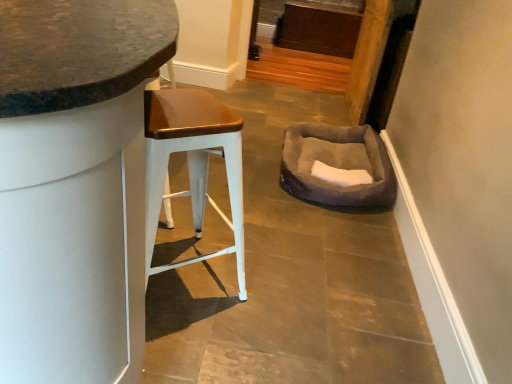
Question: Considering the relative sizes of white metal stool at left and matte white stool at left in the image provided, is white metal stool at left bigger than matte white stool at left?

Choices:
 (A) no
 (B) yes

Answer: (A)

Question: Is the depth of white metal stool at left less than that of matte white stool at left?

Choices:
 (A) yes
 (B) no

Answer: (B)

Question: Would you say white metal stool at left contains matte white stool at left?

Choices:
 (A) yes
 (B) no

Answer: (B)

Question: Does white metal stool at left have a smaller size compared to matte white stool at left?

Choices:
 (A) no
 (B) yes

Answer: (B)

Question: From the image's perspective, is white metal stool at left located above matte white stool at left?

Choices:
 (A) yes
 (B) no

Answer: (B)

Question: From a real-world perspective, relative to matte white stool at left, is white metal stool at left vertically above or below?

Choices:
 (A) above
 (B) below

Answer: (B)

Question: In the image, is white metal stool at left positioned in front of or behind matte white stool at left?

Choices:
 (A) front
 (B) behind

Answer: (B)

Question: From their relative heights in the image, would you say white metal stool at left is taller or shorter than matte white stool at left?

Choices:
 (A) tall
 (B) short

Answer: (B)

Question: From the image's perspective, is white metal stool at left positioned above or below matte white stool at left?

Choices:
 (A) above
 (B) below

Answer: (B)

Question: Considering the positions of suede-like gray bean bag at center-right and white metal stool at left in the image, is suede-like gray bean bag at center-right taller or shorter than white metal stool at left?

Choices:
 (A) short
 (B) tall

Answer: (A)

Question: Is suede-like gray bean bag at center-right spatially inside white metal stool at left, or outside of it?

Choices:
 (A) inside
 (B) outside

Answer: (B)

Question: Looking at their shapes, would you say suede-like gray bean bag at center-right is wider or thinner than white metal stool at left?

Choices:
 (A) thin
 (B) wide

Answer: (B)

Question: From a real-world perspective, is suede-like gray bean bag at center-right above or below white metal stool at left?

Choices:
 (A) below
 (B) above

Answer: (A)

Question: Considering the relative positions of matte white stool at left and suede-like gray bean bag at center-right in the image provided, is matte white stool at left to the left or to the right of suede-like gray bean bag at center-right?

Choices:
 (A) right
 (B) left

Answer: (B)

Question: Considering the positions of point (12, 248) and point (335, 152), is point (12, 248) closer or farther from the camera than point (335, 152)?

Choices:
 (A) closer
 (B) farther

Answer: (A)